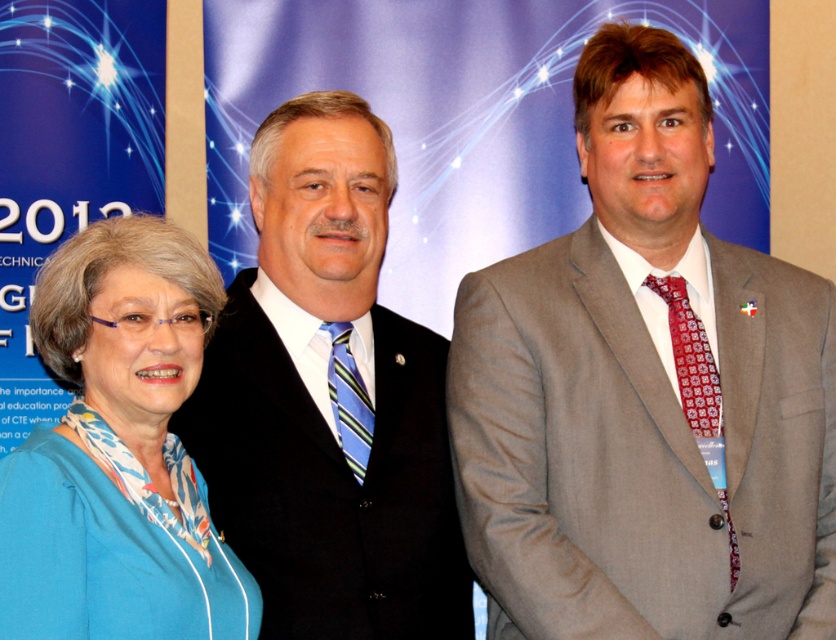
You are a photographer trying to capture a clear shot of both the gray suit at center and the blue fabric blouse at center. Which one should you focus on first to ensure it appears sharp in the photo?

You should focus on the gray suit at center first because it is closer to the viewer than the blue fabric blouse at center, ensuring it will be sharp. Adjust focus afterward for the blue fabric blouse at center if needed.

You are organizing a charity event and need to decide which outfit would be more appropriate for a speaker who needs to stand out. Based on the image, which of the two outfits, the black suit at center or the blue fabric blouse at center, would you recommend and why?

The black suit at center has a larger size compared to the blue fabric blouse at center, making it more visually prominent and thus more suitable for a speaker needing to stand out.

You are a photographer setting up a backdrop for a group photo. The backdrop has a limited width. You need to position the black suit at center and the blue fabric blouse at center such that they fit within the backdrop without overlapping. Based on their widths, which one should be placed closer to the edge to accommodate both?

The black suit at center might be wider than blue fabric blouse at center, so to fit both within the backdrop without overlapping, the wider black suit at center should be placed closer to the center, and the narrower blue fabric blouse at center should be positioned towards the edge.